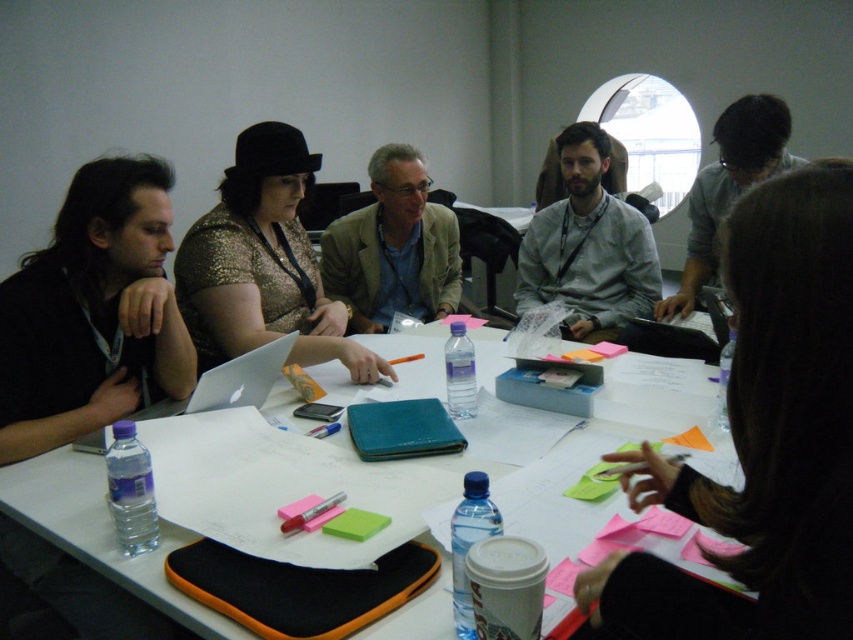
You are sitting at the rectangular table in the scene. You need to pass a document to someone wearing the black matte shirt at left. The document is currently on the matte white laptop at center. Which direction should you pass the document to reach the person?

You should pass the document to the left, since the black matte shirt at left is positioned to the left of the matte white laptop at center.

Where is the white paper at center located in the image?

The white paper at center is located at point 0.833 on the x axis and 0.116 on the y axis.

You are a participant in the meeting and need to place a small item on the table. Which object, the white paper at center or the gray matte shirt at center, can you place your item on without it falling off due to height differences?

The white paper at center is shorter than the gray matte shirt at center, so placing the item on the white paper at center would be safer as it has a more stable surface.